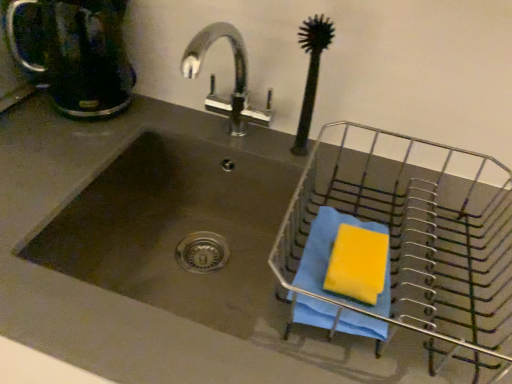
Where is `vacant space to the left of yellow sponge at right`? Image resolution: width=512 pixels, height=384 pixels. vacant space to the left of yellow sponge at right is located at coordinates (230, 335).